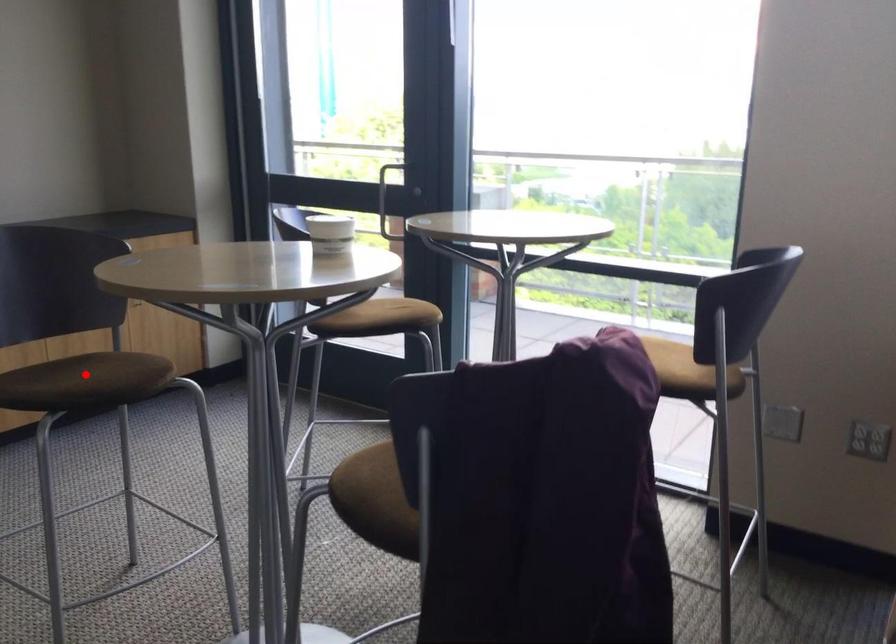
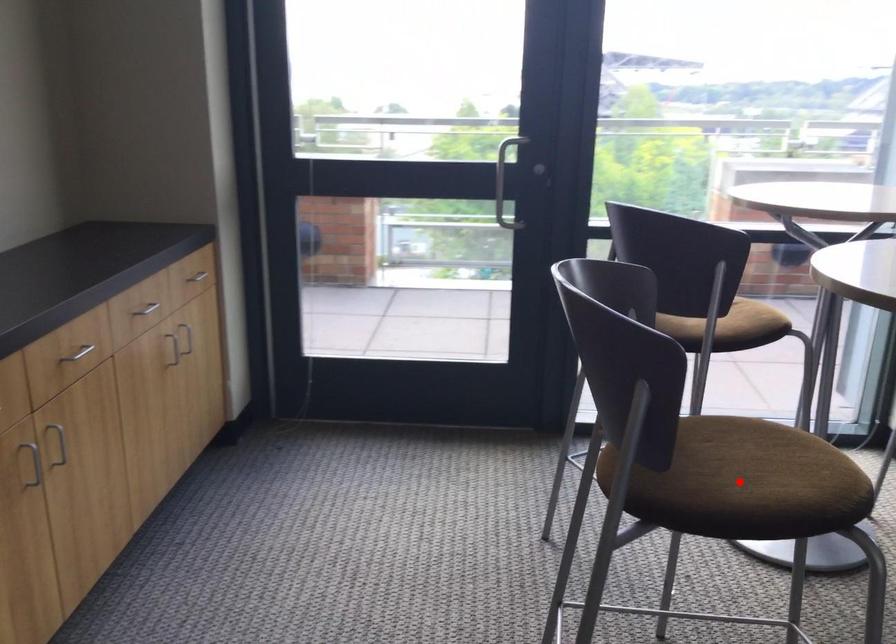
I am providing you with two images of the same scene from different viewpoints. A red point is marked on the first image and another point is marked on the second image. Is the marked point in image1 the same physical position as the marked point in image2?

Yes